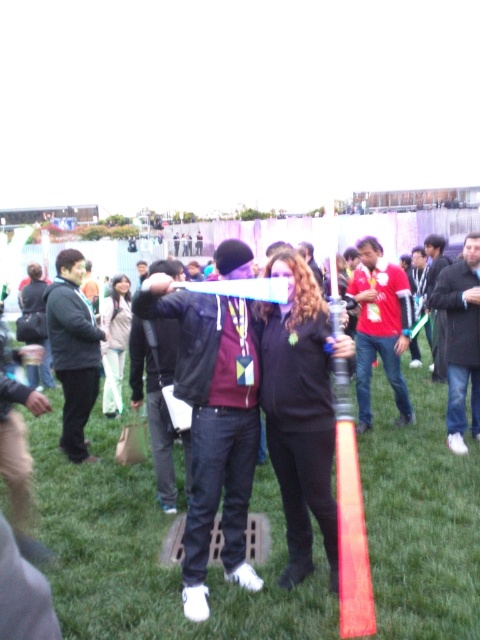
Does green grass at center come in front of light beige fabric jacket at center?

Yes, green grass at center is in front of light beige fabric jacket at center.

Does green grass at center appear on the left side of light beige fabric jacket at center?

Incorrect, green grass at center is not on the left side of light beige fabric jacket at center.

Does point (423, 493) lie in front of point (108, 378)?

Yes.

Find the location of a particular element. green grass at center is located at coordinates (153, 552).